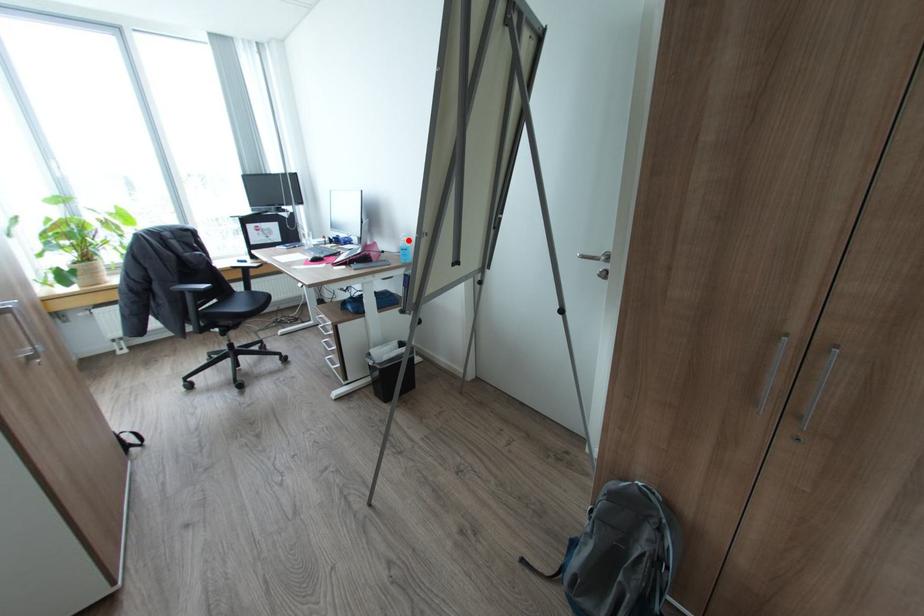
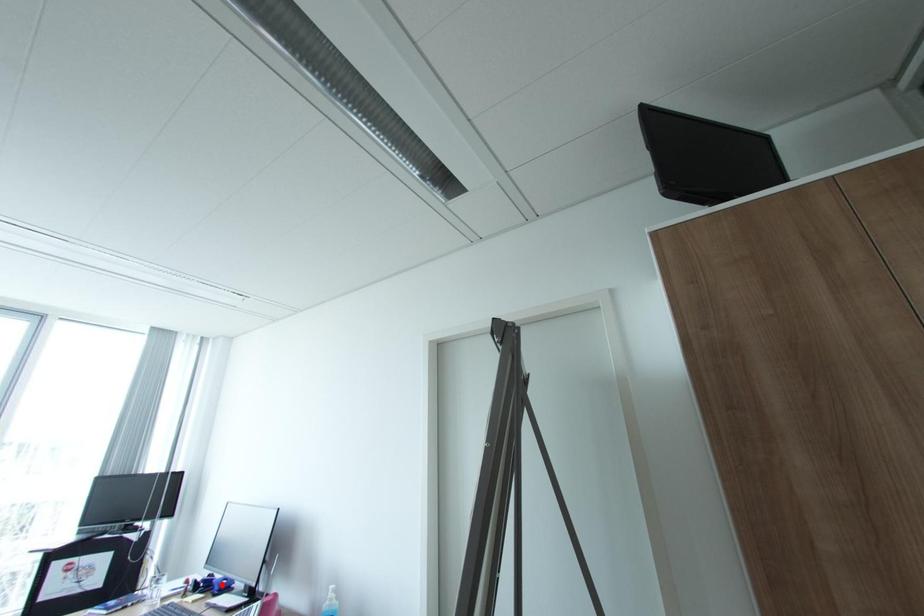
I am providing you with two images of the same scene from different viewpoints. A red point is marked on the first image and another point is marked on the second image. Does the point marked in image1 correspond to the same location as the one in image2?

No